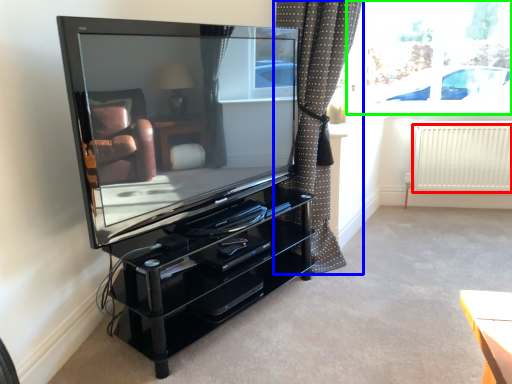
Question: Based on their relative distances, which object is nearer to radiator (highlighted by a red box)? Choose from curtain (highlighted by a blue box) and window screen (highlighted by a green box).

Choices:
 (A) curtain
 (B) window screen

Answer: (B)